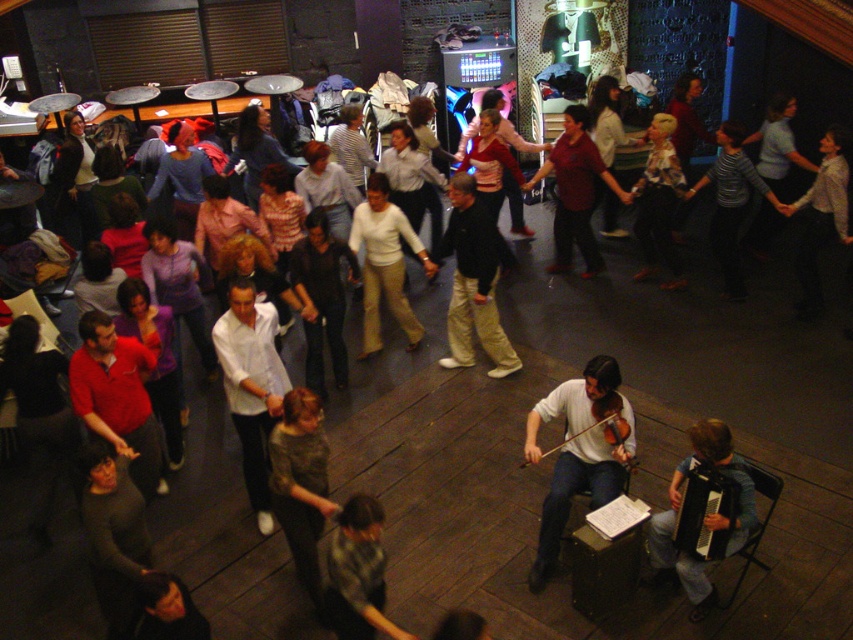
Does white matte violin at lower center appear on the right side of white matte pants at center?

Correct, you'll find white matte violin at lower center to the right of white matte pants at center.

Who is shorter, white matte violin at lower center or white matte pants at center?

white matte violin at lower center is shorter.

Between point (608, 499) and point (405, 236), which one is positioned behind?

Positioned behind is point (405, 236).

Locate an element on the screen. Image resolution: width=853 pixels, height=640 pixels. white matte violin at lower center is located at coordinates (x=579, y=451).

Does light beige pants at center have a lesser width compared to matte red shirt at center?

Yes, light beige pants at center is thinner than matte red shirt at center.

Who is more distant from viewer, (465, 337) or (576, 220)?

The point (576, 220) is more distant.

Does point (473, 312) lie in front of point (605, 186)?

Yes, it is in front of point (605, 186).

Where is `light beige pants at center`? This screenshot has height=640, width=853. light beige pants at center is located at coordinates (473, 282).

Who is more forward, (611, 413) or (560, 232)?

Point (611, 413)

Is white matte violin at lower center closer to camera compared to matte red shirt at center?

That is True.

The width and height of the screenshot is (853, 640). What do you see at coordinates (579, 451) in the screenshot? I see `white matte violin at lower center` at bounding box center [579, 451].

Image resolution: width=853 pixels, height=640 pixels. What are the coordinates of `white matte violin at lower center` in the screenshot? It's located at (579, 451).